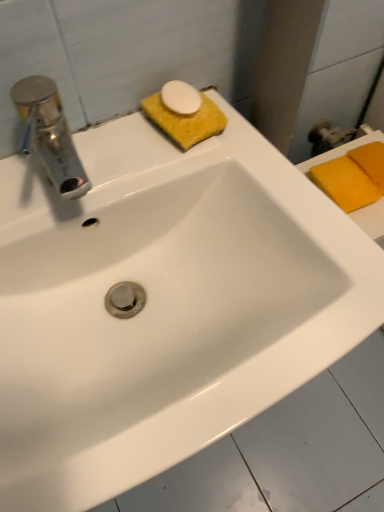
Question: Should I look upward or downward to see orange sponge at upper right, the second soap positioned from the back?

Choices:
 (A) down
 (B) up

Answer: (B)

Question: Considering the relative positions of orange sponge at upper right, the second soap positioned from the back, and yellow sponge at upper center, which is the 3th soap in back-to-front order, in the image provided, is orange sponge at upper right, the second soap positioned from the back, in front of yellow sponge at upper center, which is the 3th soap in back-to-front order,?

Choices:
 (A) yes
 (B) no

Answer: (B)

Question: Is orange sponge at upper right, acting as the second soap starting from the left, smaller than yellow sponge at upper center, positioned as the 1th soap in left-to-right order?

Choices:
 (A) no
 (B) yes

Answer: (A)

Question: Can we say orange sponge at upper right, acting as the second soap starting from the left, lies outside yellow sponge at upper center, positioned as the 1th soap in left-to-right order?

Choices:
 (A) no
 (B) yes

Answer: (B)

Question: Can you confirm if orange sponge at upper right, acting as the second soap starting from the left, is positioned to the left of yellow sponge at upper center, the 3th soap viewed from the right?

Choices:
 (A) no
 (B) yes

Answer: (A)

Question: From a real-world perspective, is orange sponge at upper right, the second soap positioned from the back, below yellow sponge at upper center, which is the 3th soap in back-to-front order?

Choices:
 (A) yes
 (B) no

Answer: (A)

Question: Is orange sponge at upper right, the second soap positioned from the back, placed right next to yellow sponge at upper center, which is the 3th soap in back-to-front order?

Choices:
 (A) no
 (B) yes

Answer: (A)

Question: Is yellow sponge at upper center, acting as the 1th soap starting from the front, positioned before orange sponge at upper right, arranged as the 2th soap when viewed from the front?

Choices:
 (A) yes
 (B) no

Answer: (A)

Question: Does yellow sponge at upper center, acting as the 1th soap starting from the front, come behind orange sponge at upper right, arranged as the 2th soap when viewed from the front?

Choices:
 (A) no
 (B) yes

Answer: (A)

Question: Does yellow sponge at upper center, the 3th soap viewed from the right, have a smaller size compared to orange sponge at upper right, the second soap when ordered from right to left?

Choices:
 (A) no
 (B) yes

Answer: (B)

Question: Is yellow sponge at upper center, acting as the 1th soap starting from the front, not near orange sponge at upper right, acting as the second soap starting from the left?

Choices:
 (A) yes
 (B) no

Answer: (B)

Question: Does yellow sponge at upper center, positioned as the 1th soap in left-to-right order, have a lesser width compared to orange sponge at upper right, the second soap positioned from the back?

Choices:
 (A) yes
 (B) no

Answer: (A)

Question: Could you tell me if yellow sponge at upper center, the 3th soap viewed from the right, is facing orange sponge at upper right, acting as the second soap starting from the left?

Choices:
 (A) no
 (B) yes

Answer: (A)

Question: Can you confirm if yellow sponge at right, acting as the first soap starting from the right, is shorter than yellow sponge at upper center, which is the 3th soap in back-to-front order?

Choices:
 (A) no
 (B) yes

Answer: (A)